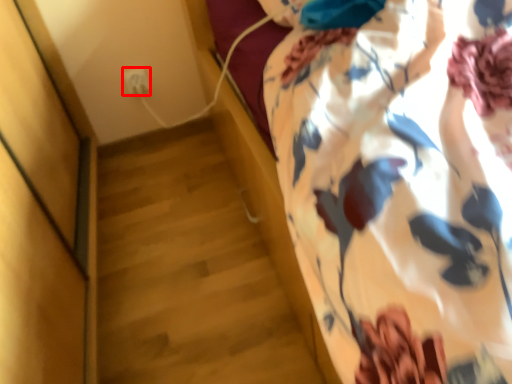
Question: Where is electric outlet (annotated by the red box) located in relation to curtain in the image?

Choices:
 (A) left
 (B) right

Answer: (A)